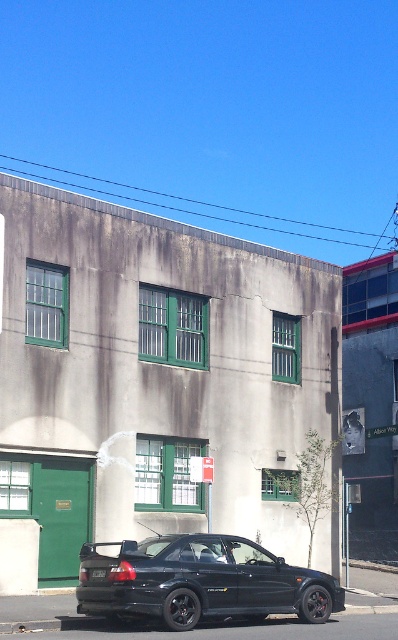
Question: Which point appears farthest from the camera in this image?

Choices:
 (A) 181,557
 (B) 97,577

Answer: (A)

Question: Is matte black car at lower center above black plastic license plate at center?

Choices:
 (A) yes
 (B) no

Answer: (B)

Question: Can you confirm if matte black car at lower center is positioned to the right of black plastic license plate at center?

Choices:
 (A) no
 (B) yes

Answer: (B)

Question: Does matte black car at lower center have a smaller size compared to black plastic license plate at center?

Choices:
 (A) no
 (B) yes

Answer: (A)